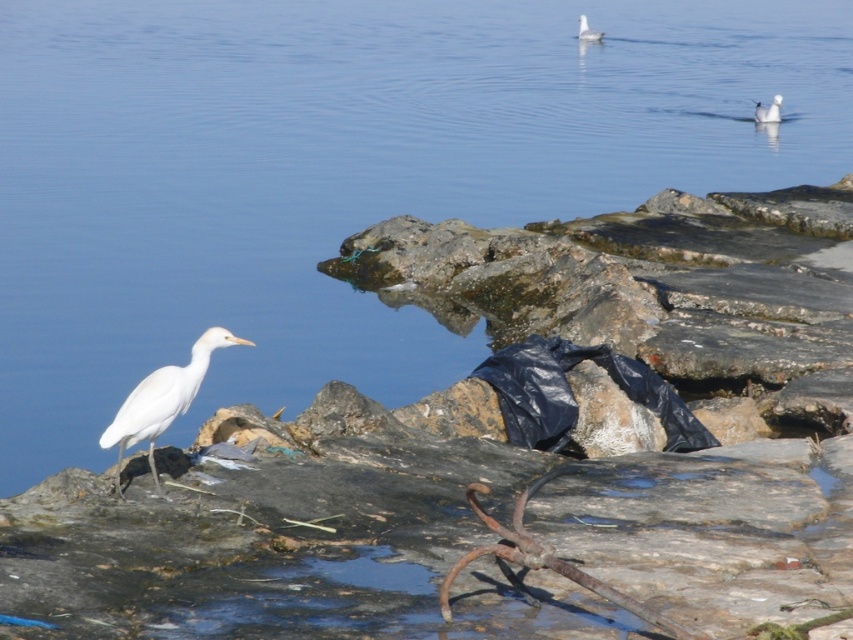
You are a birdwatcher observing the scene. You notice two white matte birds in the image. Which one is positioned closer to you, the white matte bird at left or the white matte bird at upper center?

The white matte bird at left is closer to the viewer than the white matte bird at upper center according to the description.

You are an ornithologist observing two white matte birds in the coastal scene. Which bird is closer to you, the white matte bird at left or the white matte bird at upper right?

The white matte bird at left is closer to you because it is larger in size than the white matte bird at upper right.